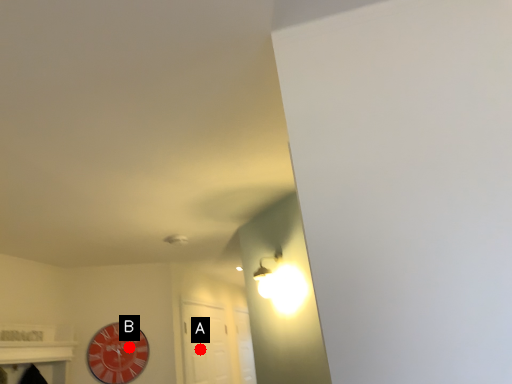
Question: Two points are circled on the image, labeled by A and B beside each circle. Which point is closer to the camera taking this photo?

Choices:
 (A) A is closer
 (B) B is closer

Answer: (B)